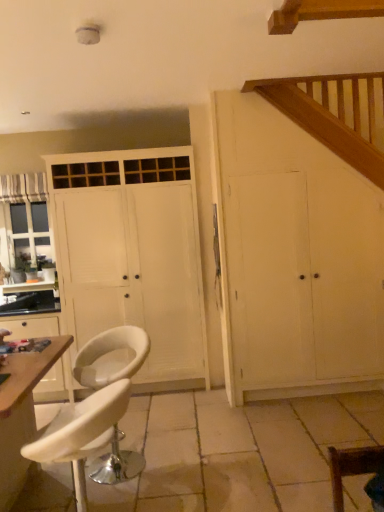
Locate an element on the screen. vacant region under white leather bar stool at lower left, the third chair viewed from the front (from a real-world perspective) is located at coordinates (132, 465).